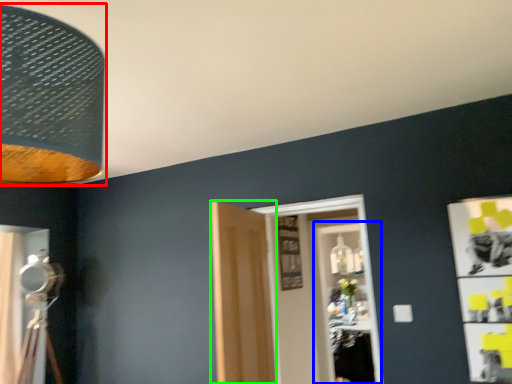
Question: Which object is the farthest from lamp (highlighted by a red box)? Choose among these: glass door (highlighted by a blue box) or door (highlighted by a green box).

Choices:
 (A) glass door
 (B) door

Answer: (A)